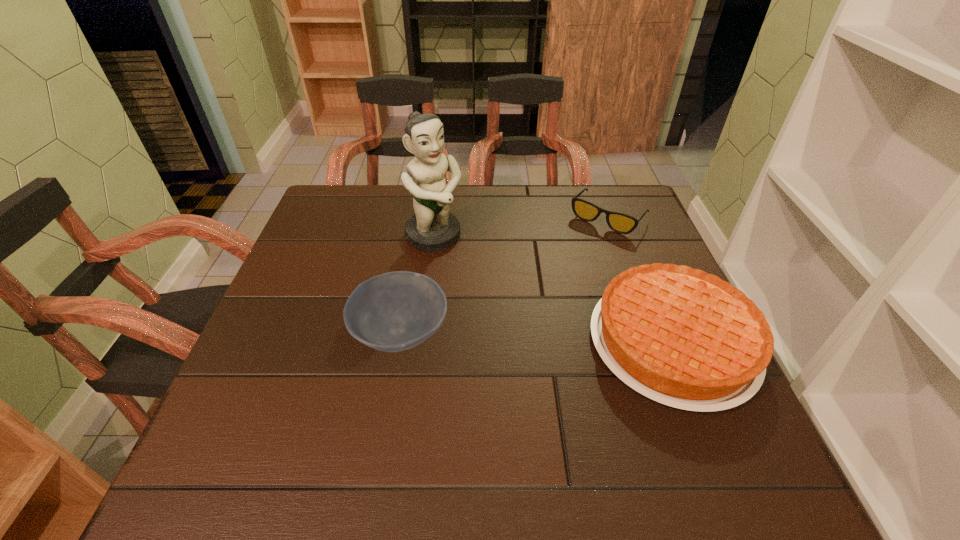
Where is `vacant space located on the front-facing side of the figurine`? This screenshot has width=960, height=540. vacant space located on the front-facing side of the figurine is located at coordinates (521, 323).

Where is `vacant space located on the front-facing side of the figurine`? The width and height of the screenshot is (960, 540). vacant space located on the front-facing side of the figurine is located at coordinates (552, 354).

Find the location of `sunglasses that is at the far edge`. sunglasses that is at the far edge is located at coordinates (621, 223).

The image size is (960, 540). I want to click on figurine at the far edge, so click(432, 228).

This screenshot has height=540, width=960. Find the location of `object that is positioned at the near edge`. object that is positioned at the near edge is located at coordinates (679, 336).

Locate an element on the screen. pie that is at the right edge is located at coordinates (679, 336).

Where is `sunglasses positioned at the right edge`? sunglasses positioned at the right edge is located at coordinates (621, 223).

In order to click on object present at the far right corner in this screenshot , I will do `click(621, 223)`.

This screenshot has height=540, width=960. In order to click on object present at the near right corner in this screenshot , I will do `click(679, 336)`.

Locate an element on the screen. The height and width of the screenshot is (540, 960). vacant space at the far edge of the desktop is located at coordinates (495, 219).